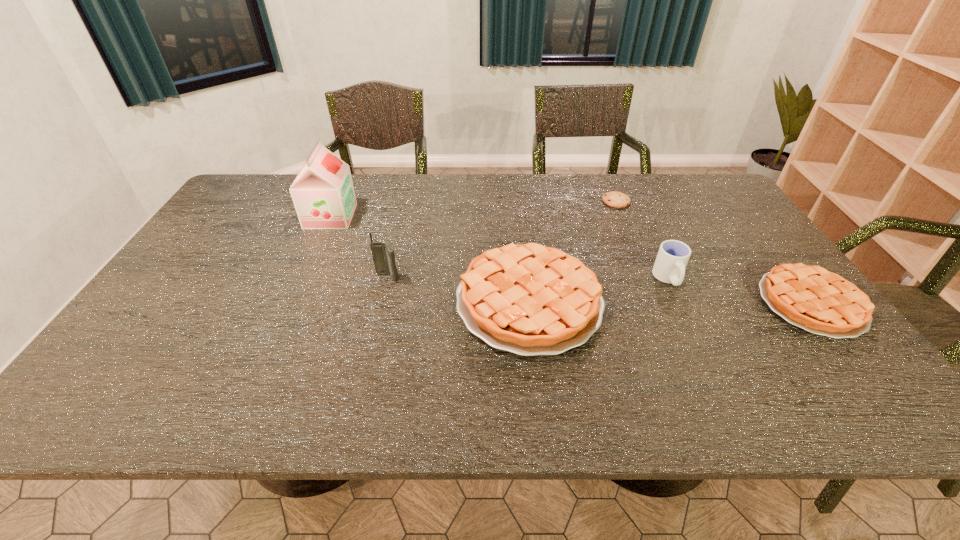
In order to click on vacant area that lies between the shortest object and the tallest object in this screenshot , I will do `click(473, 208)`.

Identify which object is located as the nearest to the leftmost object. Please provide its 2D coordinates. Your answer should be formatted as a tuple, i.e. [(x, y)], where the tuple contains the x and y coordinates of a point satisfying the conditions above.

[(383, 254)]

Select which object appears as the third closest to the second object from left to right. Please provide its 2D coordinates. Your answer should be formatted as a tuple, i.e. [(x, y)], where the tuple contains the x and y coordinates of a point satisfying the conditions above.

[(669, 267)]

At what (x,y) coordinates should I click in order to perform the action: click on free space in the image that satisfies the following two spatial constraints: 1. on the keyboard of the second tallest object; 2. on the right side of the left pie. Please return your answer as a coordinate pair (x, y). The height and width of the screenshot is (540, 960). Looking at the image, I should click on (382, 301).

The height and width of the screenshot is (540, 960). In order to click on vacant region that satisfies the following two spatial constraints: 1. on the front side of the left pie; 2. on the right side of the second shortest object in this screenshot , I will do (x=529, y=303).

This screenshot has height=540, width=960. I want to click on blank area in the image that satisfies the following two spatial constraints: 1. on the back side of the shortest object; 2. on the right side of the taller pie, so click(x=517, y=201).